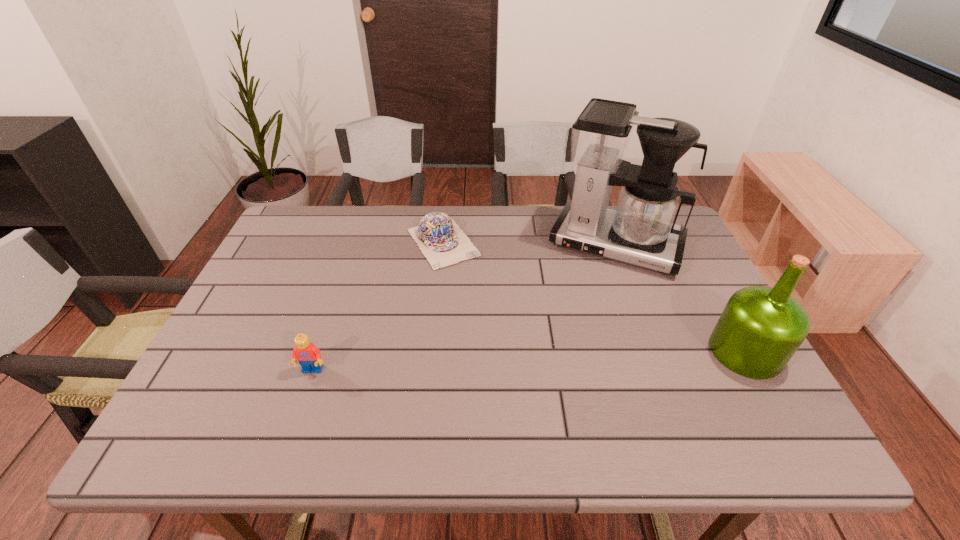
The width and height of the screenshot is (960, 540). I want to click on Lego, so click(308, 355).

Find the location of a particular element. The width and height of the screenshot is (960, 540). the third tallest object is located at coordinates (308, 355).

Where is `the third shortest object`? This screenshot has width=960, height=540. the third shortest object is located at coordinates (760, 329).

What are the coordinates of `coffee maker` in the screenshot? It's located at (641, 231).

Where is `the second object from left to right`? the second object from left to right is located at coordinates (442, 242).

At what (x,y) coordinates should I click in order to perform the action: click on cap. Please return your answer as a coordinate pair (x, y). Looking at the image, I should click on (442, 242).

The image size is (960, 540). Find the location of `free spot located on the face of the third tallest object`. free spot located on the face of the third tallest object is located at coordinates (301, 401).

You are a GUI agent. You are given a task and a screenshot of the screen. Output one action in this format:
    pyautogui.click(x=<x>, y=<y>)
    Task: Click on the free space located 0.330m on the back of the second tallest object
    Image resolution: width=960 pixels, height=540 pixels.
    Given the screenshot: What is the action you would take?
    coord(685,245)

In order to click on vacant space located at the front of the coffee maker where the controls are located in this screenshot , I will do `click(558, 379)`.

Identify the location of free space located at the front of the coffee maker where the controls are located. Image resolution: width=960 pixels, height=540 pixels. (560, 376).